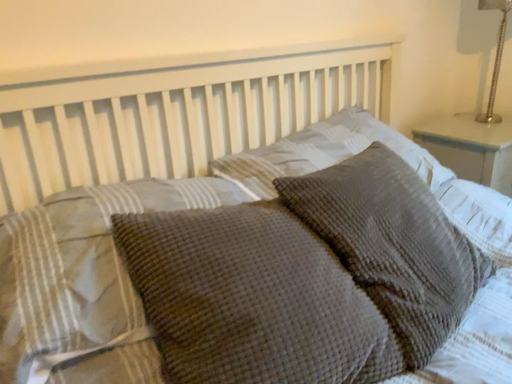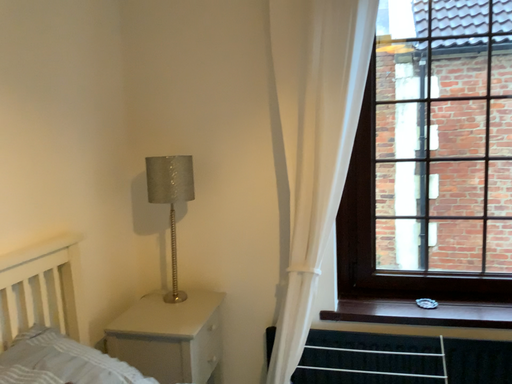
Question: How did the camera likely rotate when shooting the video?

Choices:
 (A) rotated downward
 (B) rotated upward

Answer: (B)